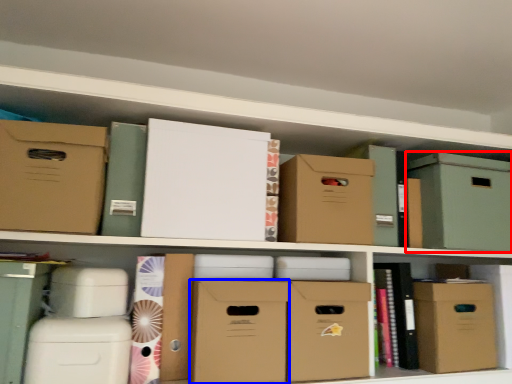
Question: Which object appears closest to the camera in this image, cardboard box (highlighted by a red box) or cardboard box (highlighted by a blue box)?

Choices:
 (A) cardboard box
 (B) cardboard box

Answer: (B)